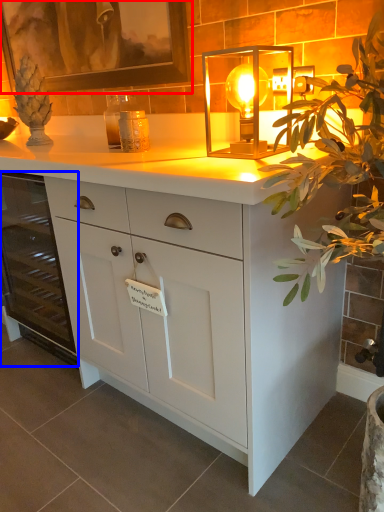
Question: Which point is further to the camera, picture frame (highlighted by a red box) or cabinetry (highlighted by a blue box)?

Choices:
 (A) picture frame
 (B) cabinetry

Answer: (B)